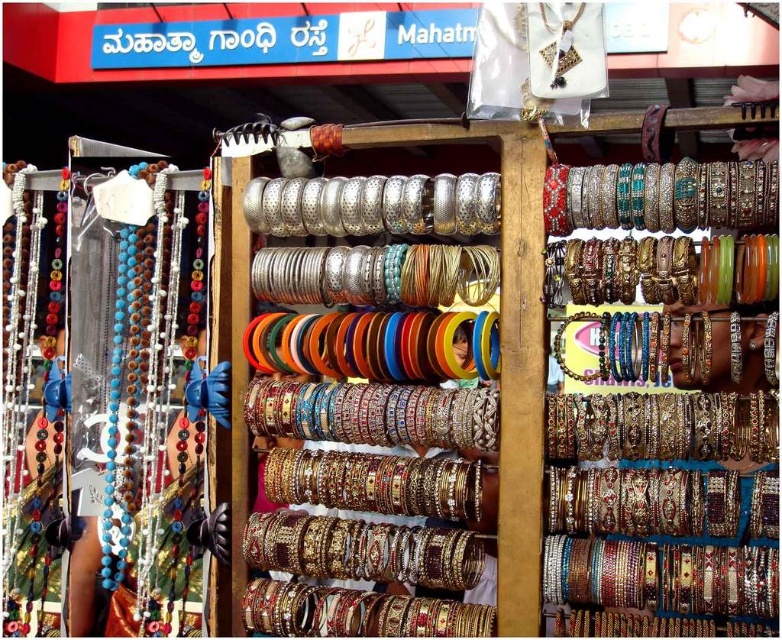
Question: Which point is farther to the camera?

Choices:
 (A) (404, 588)
 (B) (705, 337)

Answer: (A)

Question: Is matte glass beads at left below multicolored beaded bangles at center?

Choices:
 (A) no
 (B) yes

Answer: (B)

Question: Which is nearer to the multicolored beaded bangles at center?

Choices:
 (A) matte glass beads at left
 (B) metallic bangles at center

Answer: (B)

Question: Among these points, which one is nearest to the camera?

Choices:
 (A) (368, 582)
 (B) (109, 413)

Answer: (B)

Question: Does matte glass beads at left have a lesser width compared to multicolored beaded bangles at center?

Choices:
 (A) no
 (B) yes

Answer: (A)

Question: Does matte glass beads at left appear on the left side of metallic bangles at center?

Choices:
 (A) yes
 (B) no

Answer: (A)